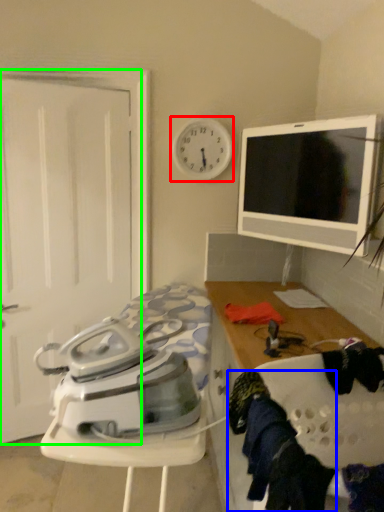
Question: Which is farther away from clock (highlighted by a red box)? clothing (highlighted by a blue box) or screen door (highlighted by a green box)?

Choices:
 (A) clothing
 (B) screen door

Answer: (A)